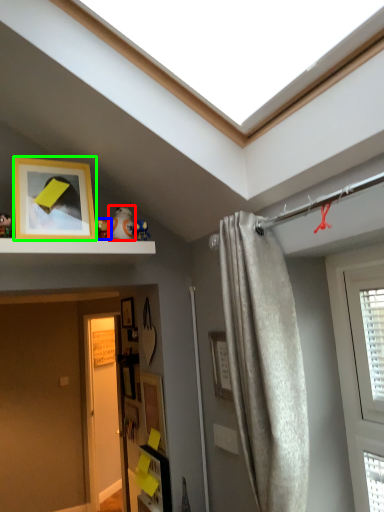
Question: Estimate the real-world distances between objects in this image. Which object is farther from toy (highlighted by a red box), toy (highlighted by a blue box) or picture frame (highlighted by a green box)?

Choices:
 (A) toy
 (B) picture frame

Answer: (B)